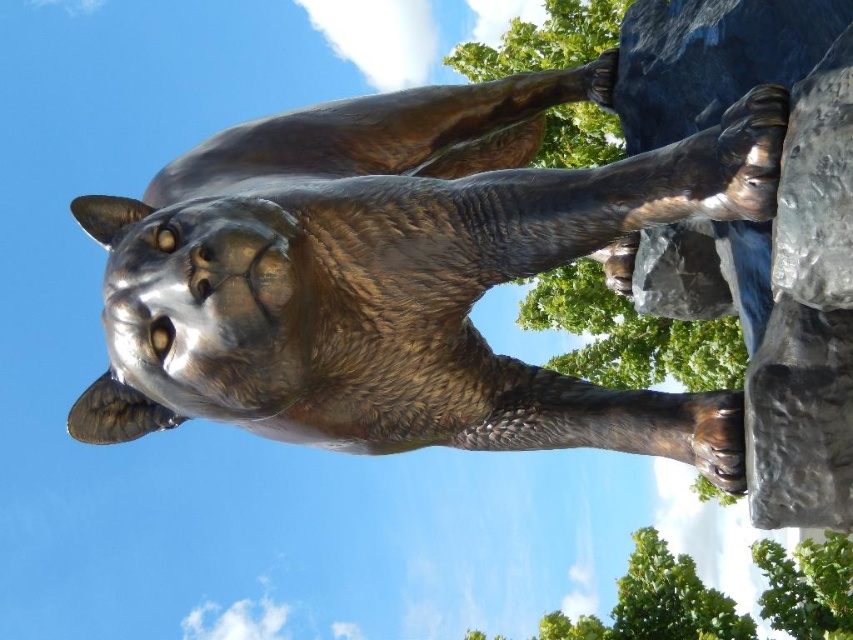
Question: Is bronze statue at center positioned behind dark gray rough stone at upper right?

Choices:
 (A) no
 (B) yes

Answer: (A)

Question: Can you confirm if bronze statue at center is thinner than dark gray rough stone at upper right?

Choices:
 (A) yes
 (B) no

Answer: (B)

Question: Which point is farther to the camera?

Choices:
 (A) (206, 365)
 (B) (683, 115)

Answer: (B)

Question: Which of the following is the closest to the observer?

Choices:
 (A) dark gray rough stone at upper right
 (B) bronze statue at center

Answer: (B)

Question: Can you confirm if bronze statue at center is positioned to the right of dark gray rough stone at upper right?

Choices:
 (A) no
 (B) yes

Answer: (A)